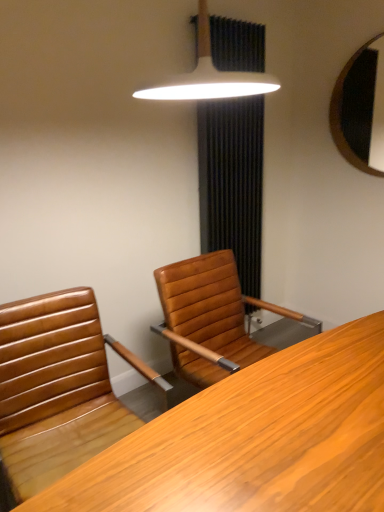
I want to click on empty space that is ontop of wooden desk at center, so click(279, 412).